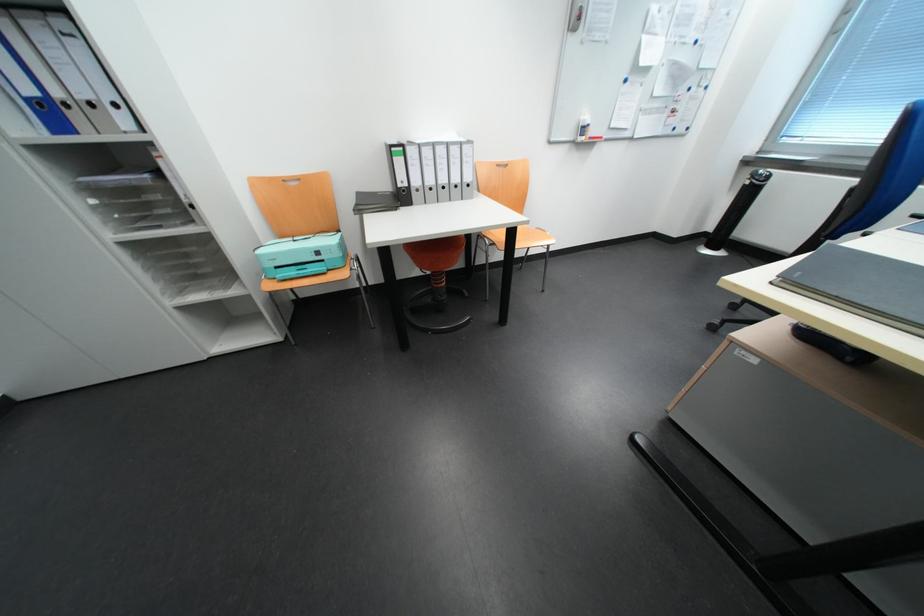
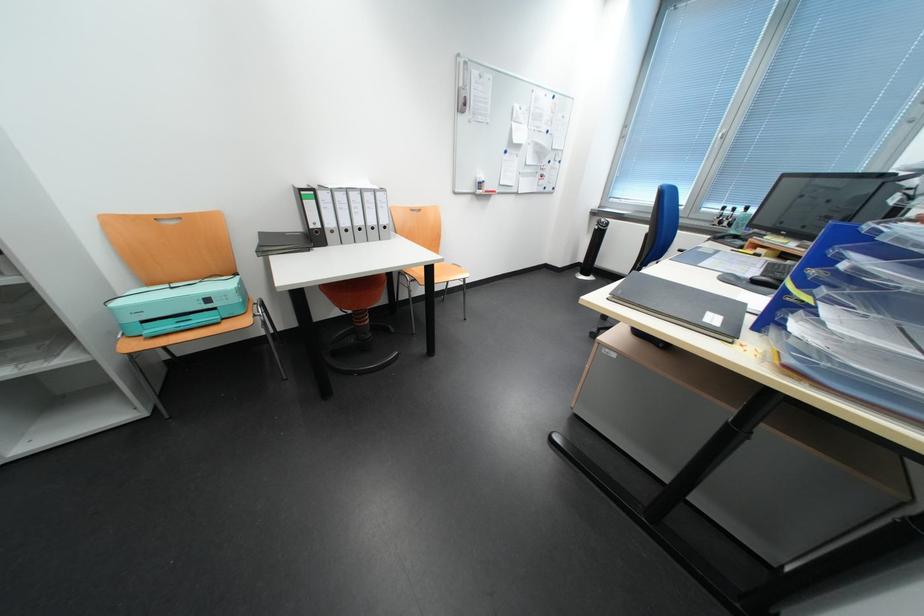
Question: The camera is either moving clockwise (left) or counter-clockwise (right) around the object. The first image is from the beginning of the video and the second image is from the end. Is the camera moving left or right when shooting the video?

Choices:
 (A) Left
 (B) Right

Answer: (A)